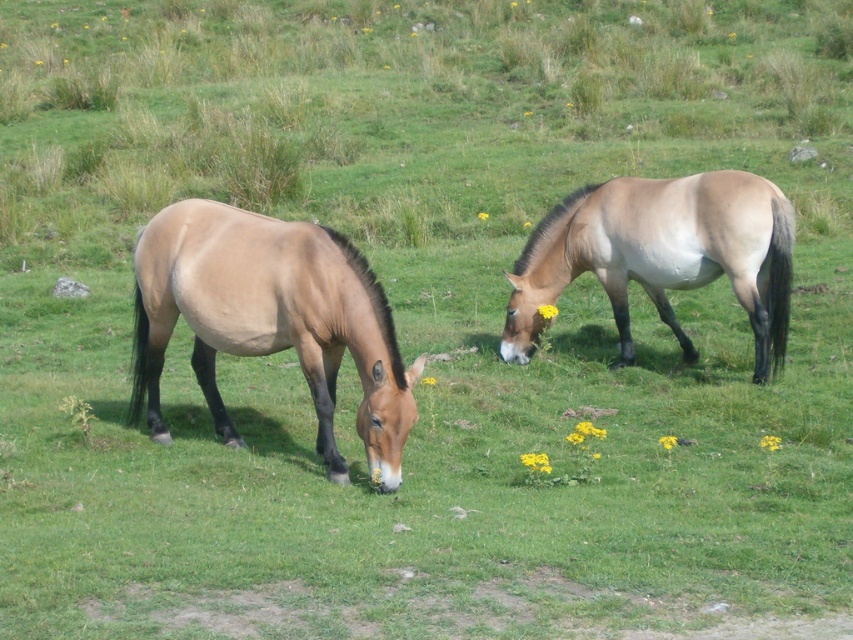
Does point (312, 248) lie behind point (676, 260)?

No, it is not.

Is point (421, 369) in front of point (741, 301)?

Yes, point (421, 369) is in front of point (741, 301).

Locate an element on the screen. brown matte horse at left is located at coordinates (270, 321).